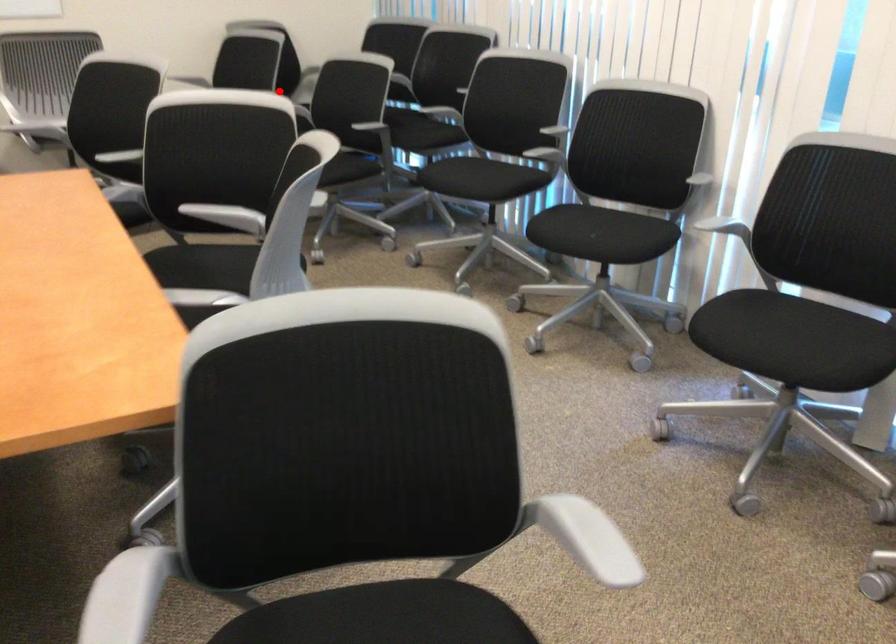
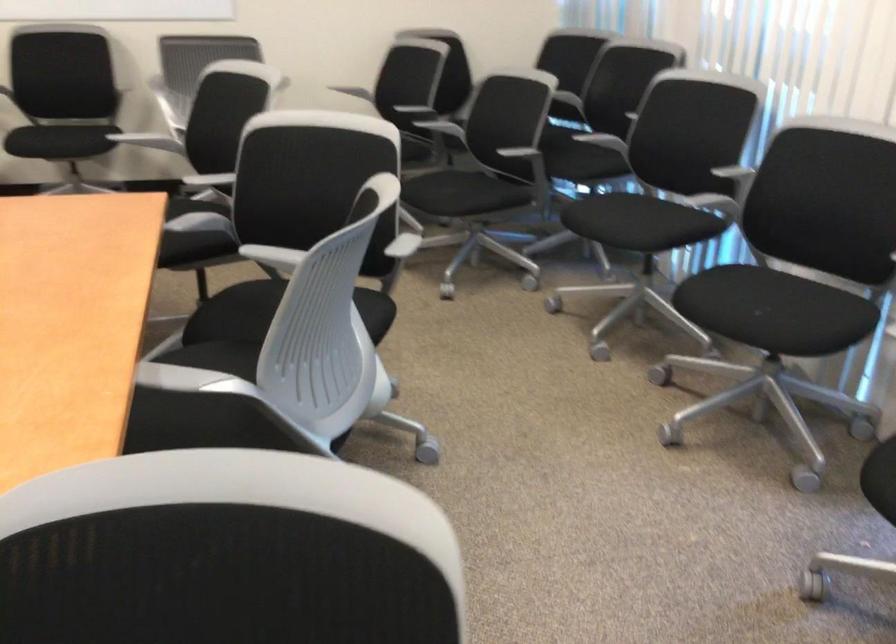
Locate, in the second image, the point that corresponds to the highlighted location in the first image.

(432, 107)